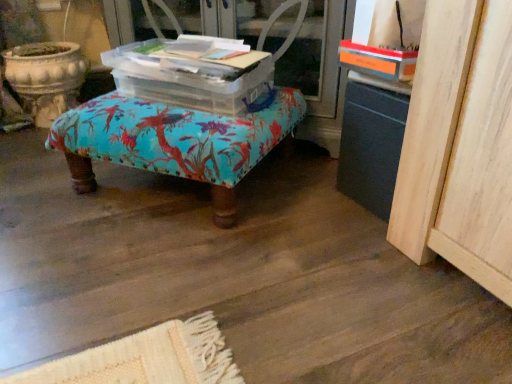
Question: Is turquoise fabric ottoman at center to the left or to the right of transparent plastic storage box at center in the image?

Choices:
 (A) right
 (B) left

Answer: (B)

Question: Looking at their shapes, would you say turquoise fabric ottoman at center is wider or thinner than transparent plastic storage box at center?

Choices:
 (A) wide
 (B) thin

Answer: (A)

Question: Estimate the real-world distances between objects in this image. Which object is farther from the turquoise fabric ottoman at center?

Choices:
 (A) transparent plastic screen door at center
 (B) transparent plastic storage box at center

Answer: (A)

Question: Which object is positioned closest to the transparent plastic screen door at center?

Choices:
 (A) turquoise fabric ottoman at center
 (B) transparent plastic storage box at center

Answer: (B)